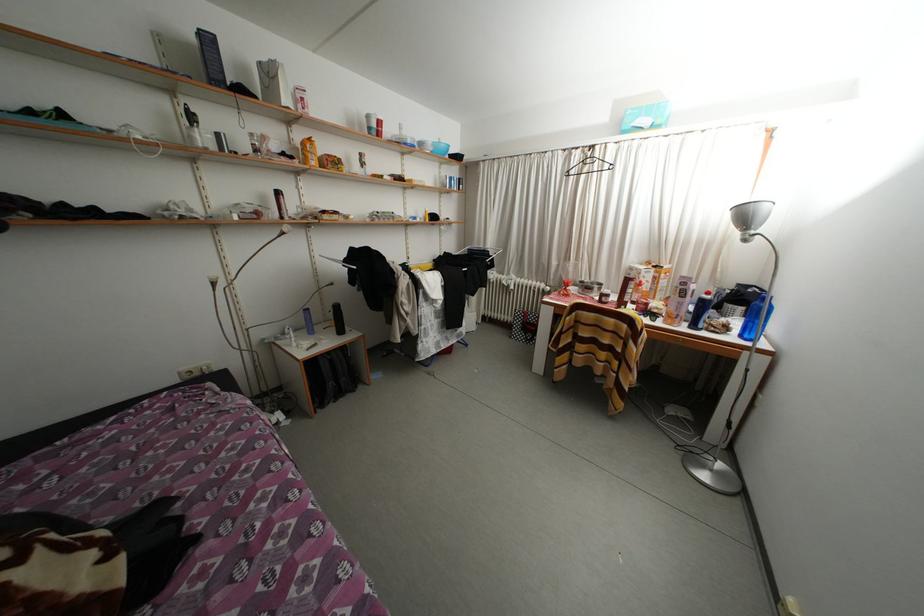
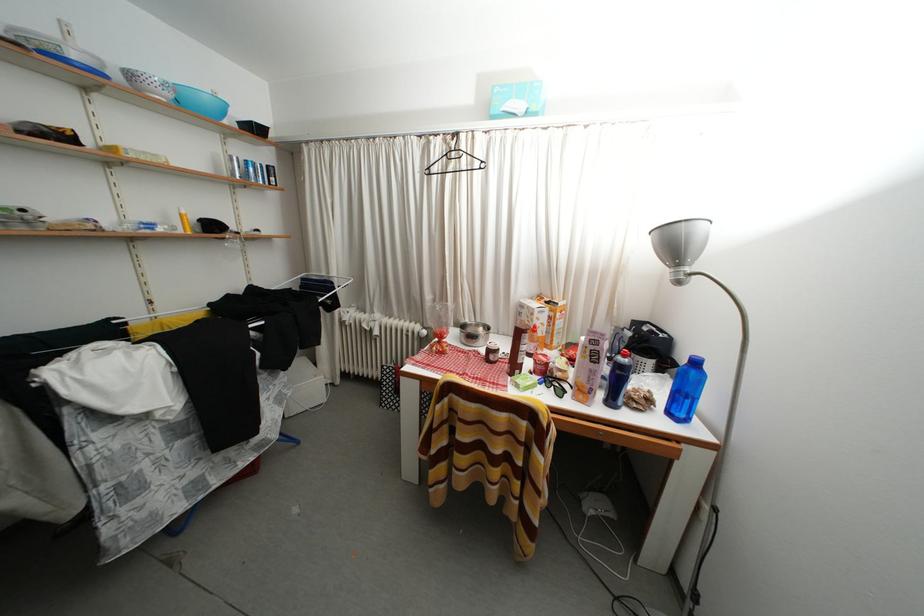
The point at (580, 294) is marked in the first image. Where is the corresponding point in the second image?

(460, 342)